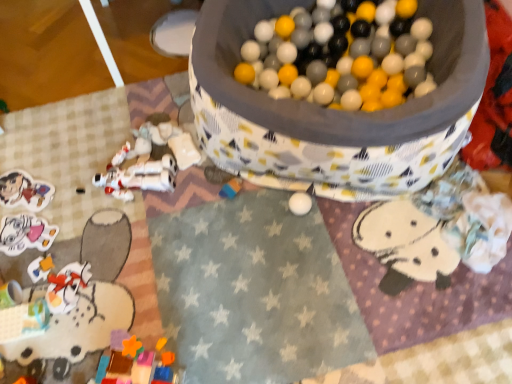
Find the location of a particular element. The height and width of the screenshot is (384, 512). free space between matte cardboard sticker at lower left, which is the first toy in left-to-right order, and fluffy white blanket at lower right, which appears as the sixth toy when viewed from the left is located at coordinates (247, 223).